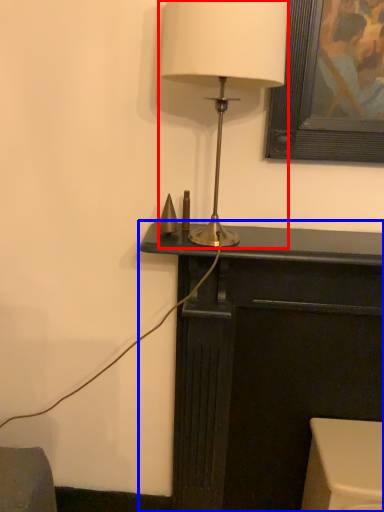
Question: Which object is further to the camera taking this photo, lamp (highlighted by a red box) or furniture (highlighted by a blue box)?

Choices:
 (A) lamp
 (B) furniture

Answer: (B)